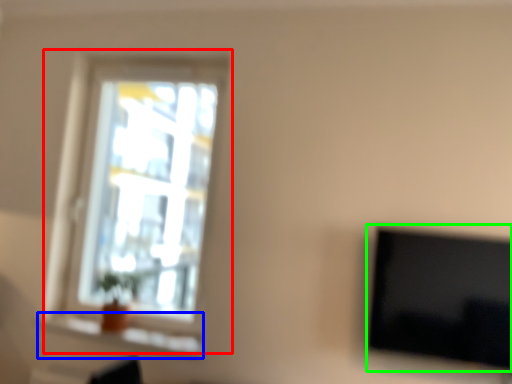
Question: Estimate the real-world distances between objects in this image. Which object is farther from window (highlighted by a red box), window sill (highlighted by a blue box) or television (highlighted by a green box)?

Choices:
 (A) window sill
 (B) television

Answer: (B)